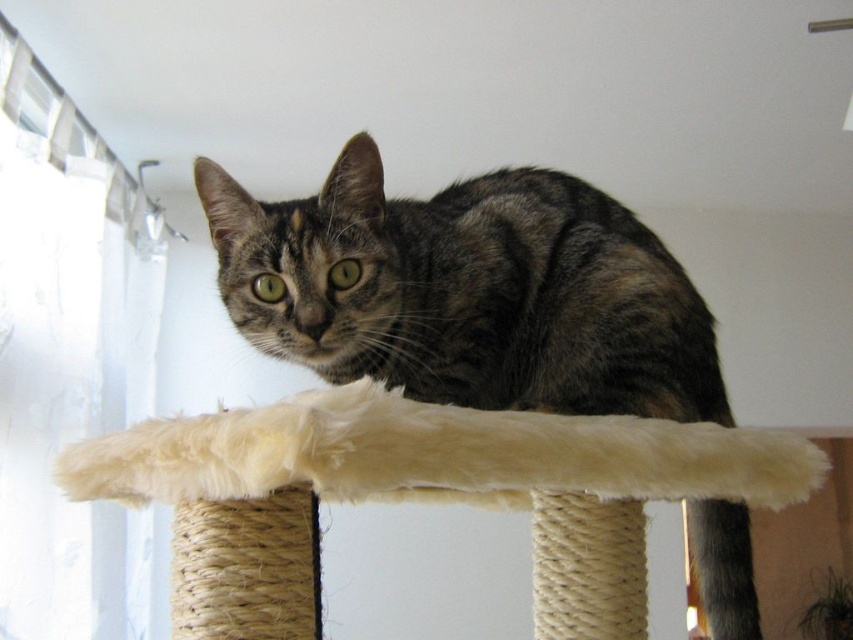
Question: Does tabby fur cat at center lie in front of white fluffy cat bed at center?

Choices:
 (A) yes
 (B) no

Answer: (B)

Question: In this image, where is tabby fur cat at center located relative to white fluffy cat bed at center?

Choices:
 (A) above
 (B) below

Answer: (A)

Question: Can you confirm if tabby fur cat at center is wider than white fluffy cat bed at center?

Choices:
 (A) yes
 (B) no

Answer: (B)